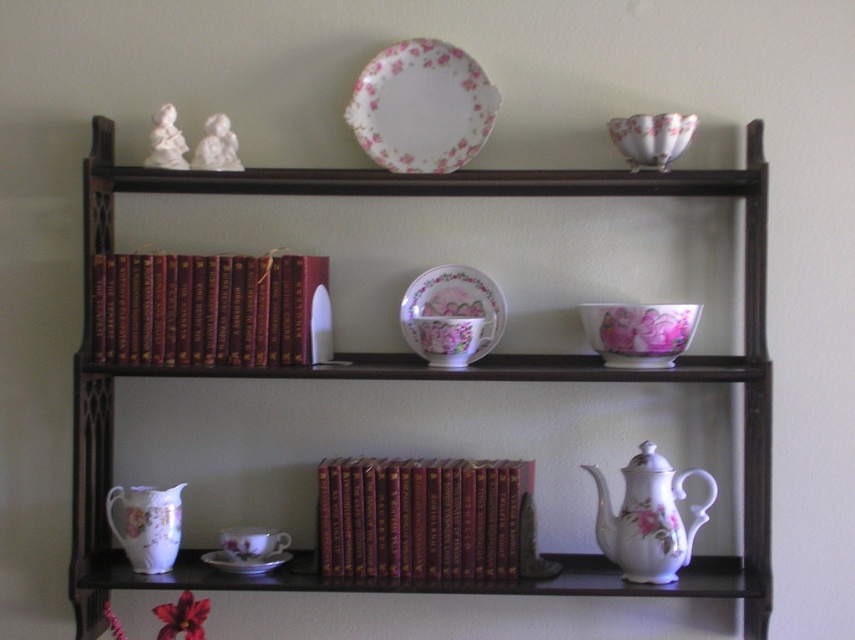
You are standing 2 meters away from the dark wooden shelf unit. If you want to touch the point at coordinates point (652, 497), will you be able to reach it without moving closer?

The distance of point (652, 497) from viewer is 1.71 meters. Since you are standing 2 meters away, you are farther than the required distance. You need to move closer to reach it.

Looking at this image, you are standing in front of the dark wooden shelf unit and want to take a photo of the floral porcelain plate at center. If your camera is 5.84 feet away from the plate, will it fit into the frame?

The floral porcelain plate at center and camera are 5.84 feet apart, which means the camera is positioned exactly at the required distance to capture the plate within the frame.

In the scene shown: You are organizing items on a shelf and need to place a new item between the floral porcelain plate at center and the porcelain floral teacup at center. Based on their positions, where should you place the new item?

The floral porcelain plate at center is above the porcelain floral teacup at center, so you should place the new item between them by positioning it below the plate but above the teacup.